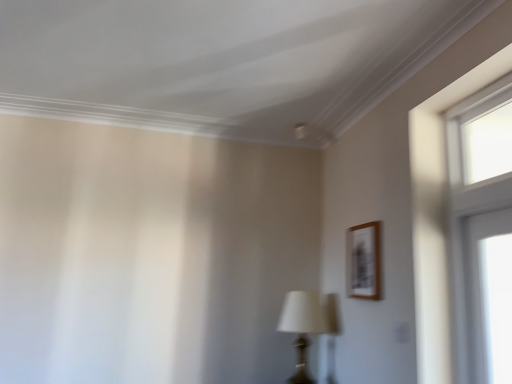
Question: In the image, is clear glass window at upper right on the left side or the right side of wooden frame at upper right?

Choices:
 (A) left
 (B) right

Answer: (B)

Question: Is clear glass window at upper right spatially inside wooden frame at upper right, or outside of it?

Choices:
 (A) inside
 (B) outside

Answer: (B)

Question: Considering the real-world distances, which object is closest to the clear glass window at upper right?

Choices:
 (A) matte black table lamp at center
 (B) wooden frame at upper right

Answer: (B)

Question: Which of these objects is positioned closest to the wooden frame at upper right?

Choices:
 (A) matte black table lamp at center
 (B) clear glass window at upper right

Answer: (A)